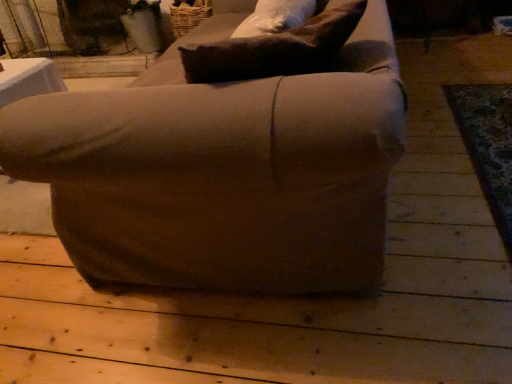
Question: Based on their sizes in the image, would you say brown fabric pillow at upper center is bigger or smaller than matte brown armchair at center?

Choices:
 (A) small
 (B) big

Answer: (A)

Question: In terms of height, does brown fabric pillow at upper center look taller or shorter compared to matte brown armchair at center?

Choices:
 (A) tall
 (B) short

Answer: (B)

Question: In terms of width, does brown fabric pillow at upper center look wider or thinner when compared to matte brown armchair at center?

Choices:
 (A) wide
 (B) thin

Answer: (B)

Question: Does point (18, 100) appear closer or farther from the camera than point (334, 16)?

Choices:
 (A) farther
 (B) closer

Answer: (A)

Question: Looking at their shapes, would you say matte brown armchair at center is wider or thinner than brown fabric pillow at upper center?

Choices:
 (A) wide
 (B) thin

Answer: (A)

Question: Looking at the image, does matte brown armchair at center seem bigger or smaller compared to brown fabric pillow at upper center?

Choices:
 (A) big
 (B) small

Answer: (A)

Question: Considering the relative positions of matte brown armchair at center and brown fabric pillow at upper center in the image provided, is matte brown armchair at center to the left or to the right of brown fabric pillow at upper center?

Choices:
 (A) right
 (B) left

Answer: (B)